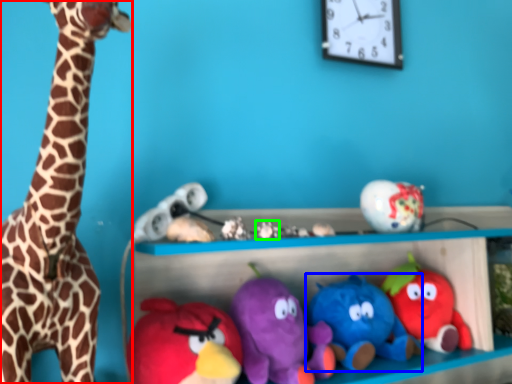
Question: Based on their relative distances, which object is nearer to giraffe (highlighted by a red box)? Choose from toy (highlighted by a blue box) and toy (highlighted by a green box).

Choices:
 (A) toy
 (B) toy

Answer: (B)